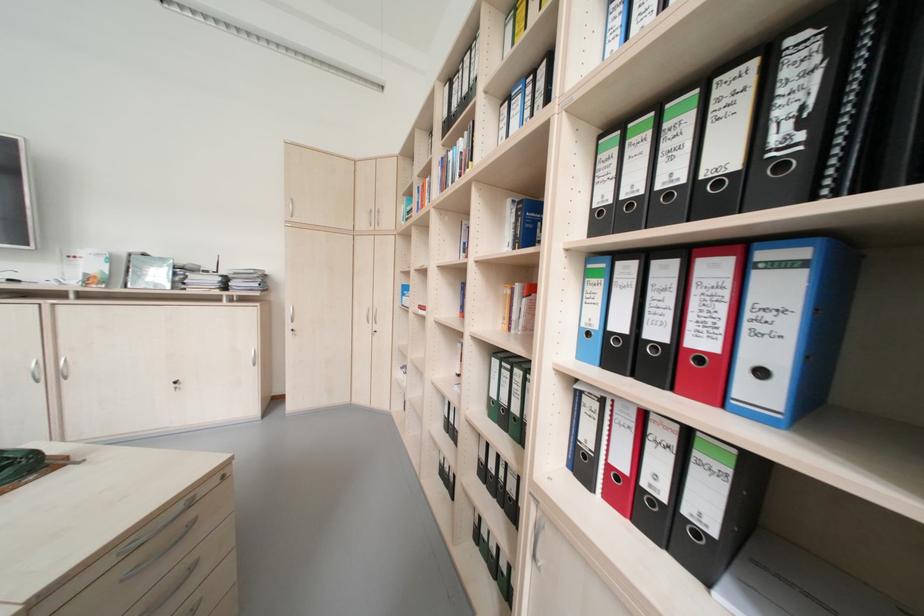
This screenshot has height=616, width=924. I want to click on blue book, so click(x=789, y=328).